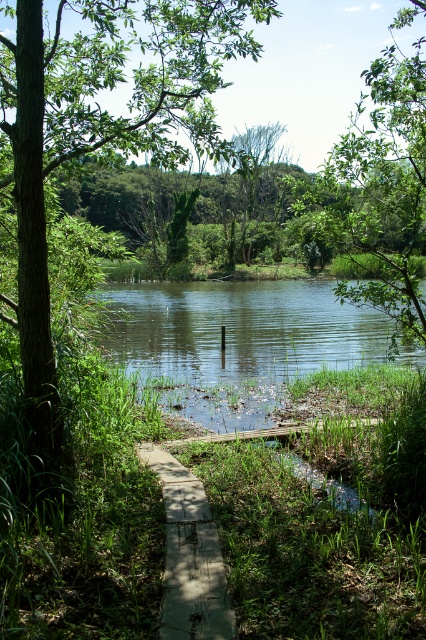
Question: Which point appears farthest from the camera in this image?

Choices:
 (A) (389, 198)
 (B) (149, 13)
 (C) (199, 609)
 (D) (316, 294)

Answer: (D)

Question: Which object is farther from the camera taking this photo?

Choices:
 (A) green grassy river at center
 (B) green leafy tree at center

Answer: (A)

Question: Which point is closer to the camera?

Choices:
 (A) (420, 10)
 (B) (75, 113)

Answer: (B)

Question: Is the position of green leafy tree at center less distant than that of green grassy river at center?

Choices:
 (A) yes
 (B) no

Answer: (A)

Question: Where is green grassy river at center located in relation to green leafy tree at upper center in the image?

Choices:
 (A) above
 (B) below

Answer: (B)

Question: Can you confirm if green leafy tree at center is bigger than wooden plank at center?

Choices:
 (A) yes
 (B) no

Answer: (A)